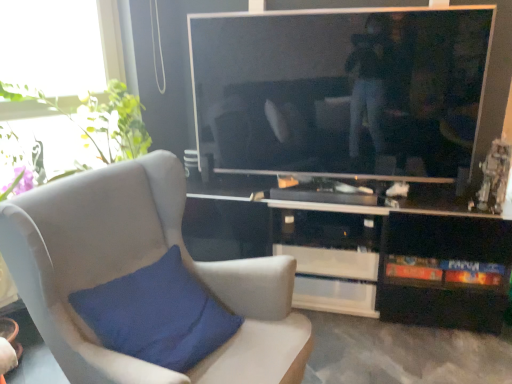
Question: Is green leafy plant at upper left not near black glossy cabinet at lower right?

Choices:
 (A) yes
 (B) no

Answer: (A)

Question: Is green leafy plant at upper left looking in the opposite direction of black glossy cabinet at lower right?

Choices:
 (A) no
 (B) yes

Answer: (A)

Question: Is green leafy plant at upper left outside of black glossy cabinet at lower right?

Choices:
 (A) yes
 (B) no

Answer: (A)

Question: Can you confirm if green leafy plant at upper left is wider than black glossy cabinet at lower right?

Choices:
 (A) no
 (B) yes

Answer: (B)

Question: Considering the relative sizes of green leafy plant at upper left and black glossy cabinet at lower right in the image provided, is green leafy plant at upper left taller than black glossy cabinet at lower right?

Choices:
 (A) no
 (B) yes

Answer: (A)

Question: Is the depth of green leafy plant at upper left less than that of black glossy cabinet at lower right?

Choices:
 (A) yes
 (B) no

Answer: (A)

Question: Considering the relative positions of suede-like beige chair at left and black glossy cabinet at lower right in the image provided, is suede-like beige chair at left in front of black glossy cabinet at lower right?

Choices:
 (A) yes
 (B) no

Answer: (A)

Question: Does suede-like beige chair at left have a larger size compared to black glossy cabinet at lower right?

Choices:
 (A) no
 (B) yes

Answer: (B)

Question: Is black glossy cabinet at lower right at the back of suede-like beige chair at left?

Choices:
 (A) yes
 (B) no

Answer: (B)

Question: Considering the relative sizes of suede-like beige chair at left and black glossy cabinet at lower right in the image provided, is suede-like beige chair at left smaller than black glossy cabinet at lower right?

Choices:
 (A) yes
 (B) no

Answer: (B)

Question: Does suede-like beige chair at left touch black glossy cabinet at lower right?

Choices:
 (A) no
 (B) yes

Answer: (A)

Question: Does suede-like beige chair at left come behind black glossy cabinet at lower right?

Choices:
 (A) no
 (B) yes

Answer: (A)

Question: Is black glossy cabinet at lower right to the left of suede-like beige chair at left from the viewer's perspective?

Choices:
 (A) yes
 (B) no

Answer: (B)